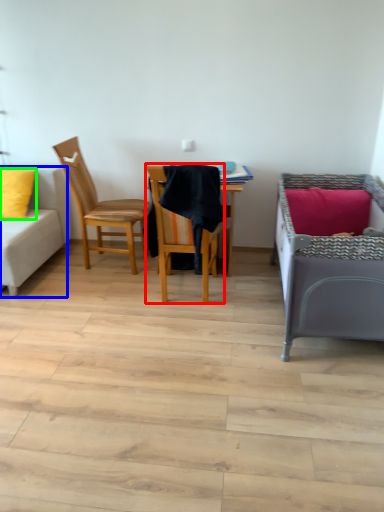
Question: Considering the real-world distances, which object is closest to chair (highlighted by a red box)? studio couch (highlighted by a blue box) or pillow (highlighted by a green box).

Choices:
 (A) studio couch
 (B) pillow

Answer: (A)